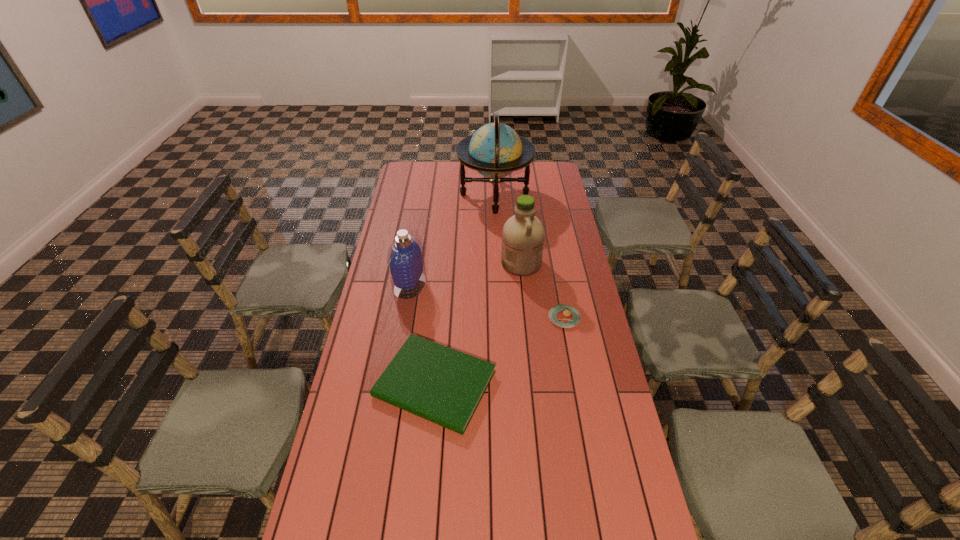
Where is `globe`? Image resolution: width=960 pixels, height=540 pixels. globe is located at coordinates (495, 150).

I want to click on the farthest object, so click(495, 150).

Locate an element on the screen. the second tallest object is located at coordinates (523, 234).

The width and height of the screenshot is (960, 540). What are the coordinates of `the taller cleansing agent` in the screenshot? It's located at (523, 234).

At what (x,y) coordinates should I click in order to perform the action: click on the left cleansing agent. Please return your answer as a coordinate pair (x, y). This screenshot has width=960, height=540. Looking at the image, I should click on (405, 258).

Where is `the third tallest object`? This screenshot has height=540, width=960. the third tallest object is located at coordinates (405, 258).

The image size is (960, 540). Identify the location of the nearest object. (445, 386).

This screenshot has width=960, height=540. Find the location of `the fourth farthest object`. the fourth farthest object is located at coordinates (566, 316).

Find the location of a particular element. vacant space located on the surface of the farthest object is located at coordinates (425, 195).

Where is `vacant space located 0.160m on the surface of the farthest object`? vacant space located 0.160m on the surface of the farthest object is located at coordinates (425, 195).